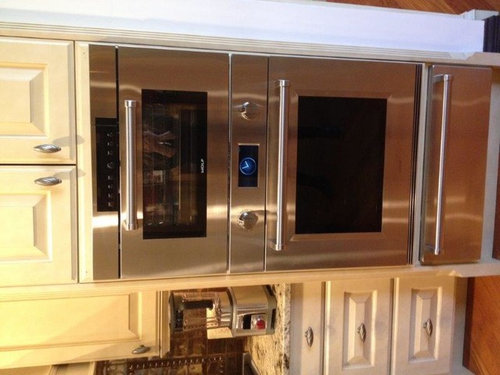
At what (x,y) coordinates should I click in order to perform the action: click on wood floor. Please return your answer as a coordinate pair (x, y). Looking at the image, I should click on (447, 7), (483, 319).